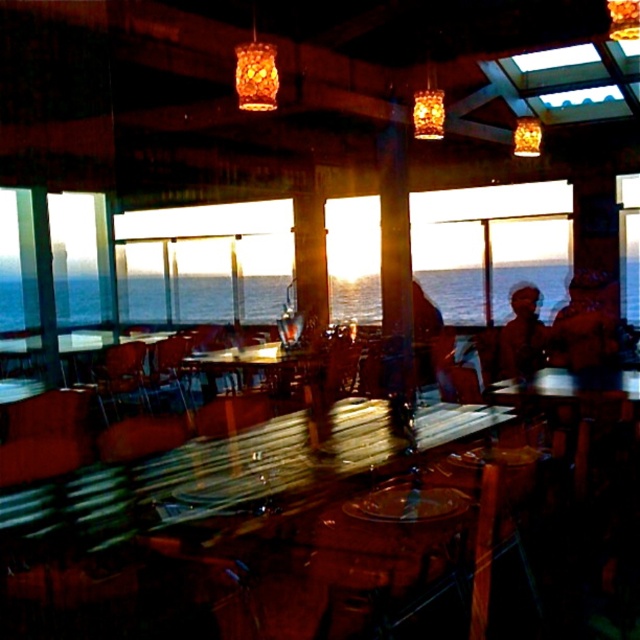
Question: Is blue water at center below wooden chair at center?

Choices:
 (A) yes
 (B) no

Answer: (B)

Question: Where is dark brown leather jacket at center located in relation to wooden chair at center in the image?

Choices:
 (A) right
 (B) left

Answer: (A)

Question: Which point appears closest to the camera in this image?

Choices:
 (A) (532, 349)
 (B) (134, 374)
 (C) (465, 280)

Answer: (A)

Question: Which of the following is the closest to the observer?

Choices:
 (A) (570, 356)
 (B) (474, 310)

Answer: (A)

Question: Observing the image, what is the correct spatial positioning of blue water at center in reference to dark brown leather jacket at center?

Choices:
 (A) above
 (B) below

Answer: (A)

Question: Estimate the real-world distances between objects in this image. Which object is farther from the patterned fabric headscarf at center?

Choices:
 (A) dark brown leather jacket at center
 (B) blue water at center

Answer: (B)